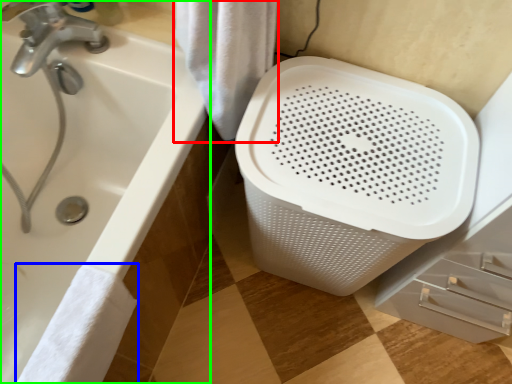
Question: Which object is the farthest from bath towel (highlighted by a red box)? Choose among these: bath towel (highlighted by a blue box) or bathtub (highlighted by a green box).

Choices:
 (A) bath towel
 (B) bathtub

Answer: (A)